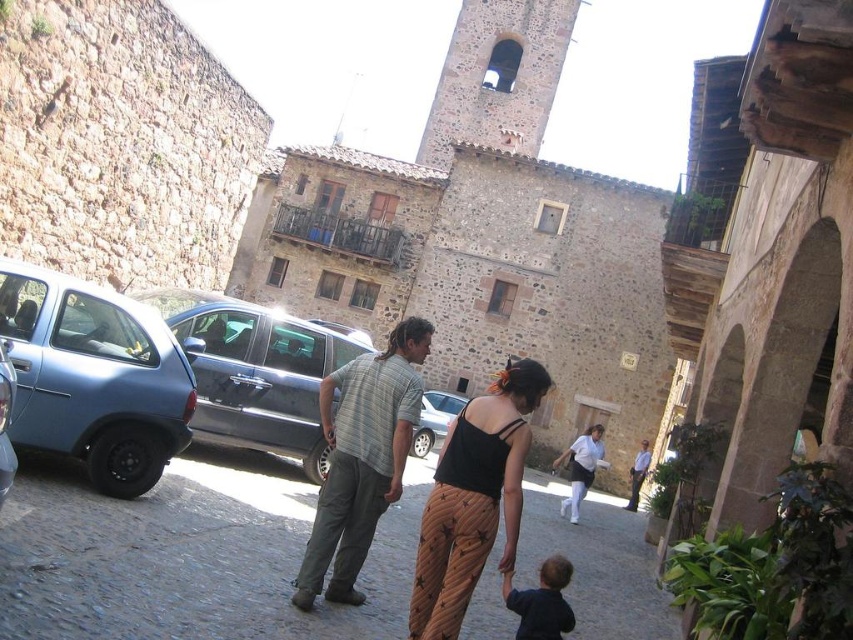
Measure the distance from metallic blue car at left to light blue shirt at center.

163.66 feet

Which is more to the right, metallic blue car at left or light blue shirt at center?

light blue shirt at center

Who is more forward, (x=9, y=362) or (x=643, y=456)?

Point (x=9, y=362) is more forward.

Find the location of a particular element. This screenshot has height=640, width=853. metallic blue car at left is located at coordinates (4, 420).

Between point (519, 397) and point (556, 465), which one is positioned in front?

Positioned in front is point (519, 397).

From the picture: Who is positioned more to the right, black cotton tank top at center or matte black tank top at center?

matte black tank top at center

Who is more forward, (461,483) or (582,458)?

Positioned in front is point (461,483).

I want to click on black cotton tank top at center, so click(x=473, y=499).

Does point (273, 317) lie in front of point (538, 595)?

No, (273, 317) is behind (538, 595).

Is metallic silver car at center wider than dark blue fabric at lower center?

Indeed, metallic silver car at center has a greater width compared to dark blue fabric at lower center.

I want to click on metallic silver car at center, so click(258, 372).

At what (x,y) coordinates should I click in order to perform the action: click on metallic silver car at center. Please return your answer as a coordinate pair (x, y). This screenshot has height=640, width=853. Looking at the image, I should click on (258, 372).